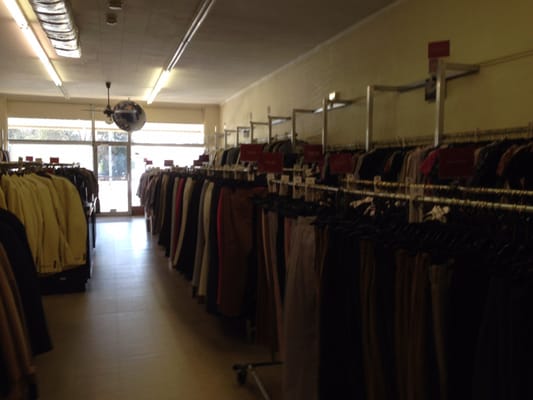
I want to click on light, so click(110, 115).